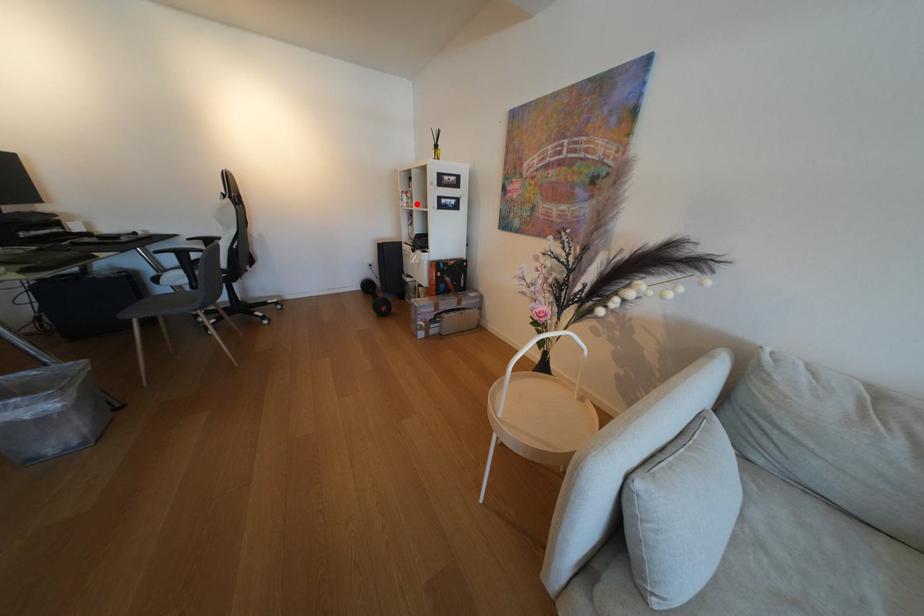
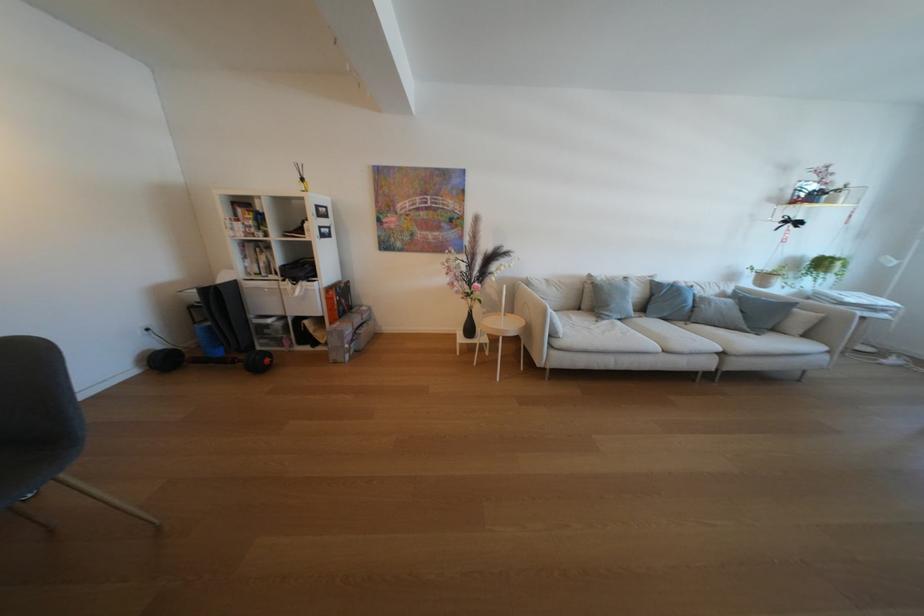
The point at the highlighted location is marked in the first image. Where is the corresponding point in the second image?

(256, 233)